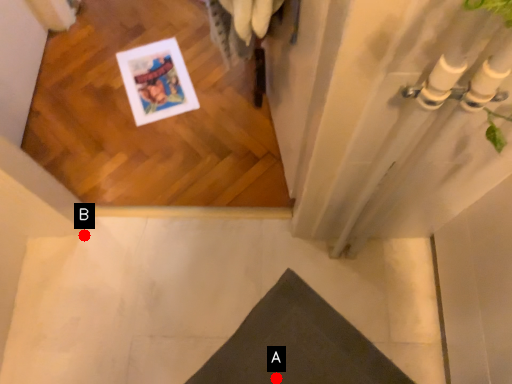
Question: Two points are circled on the image, labeled by A and B beside each circle. Which point is farther from the camera taking this photo?

Choices:
 (A) A is further
 (B) B is further

Answer: (B)